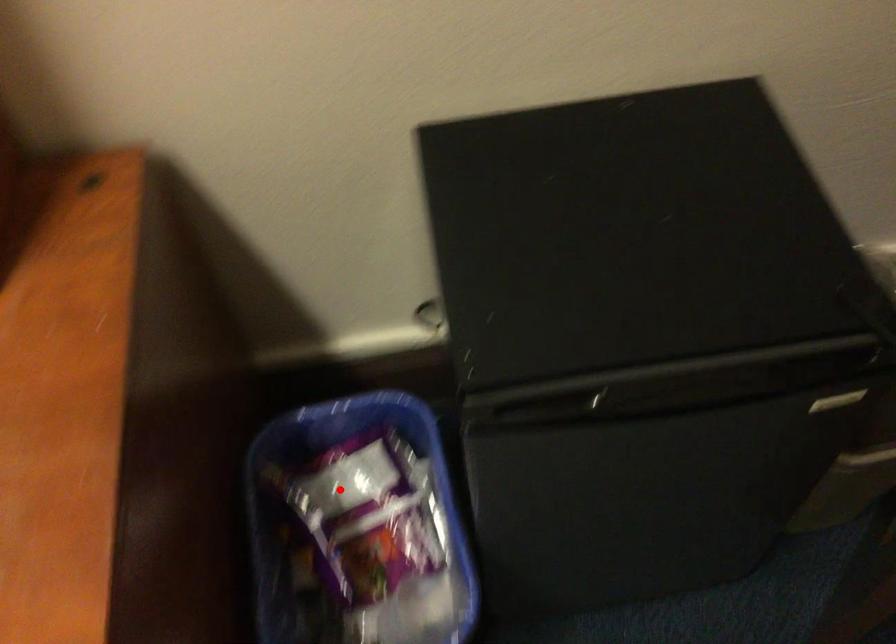
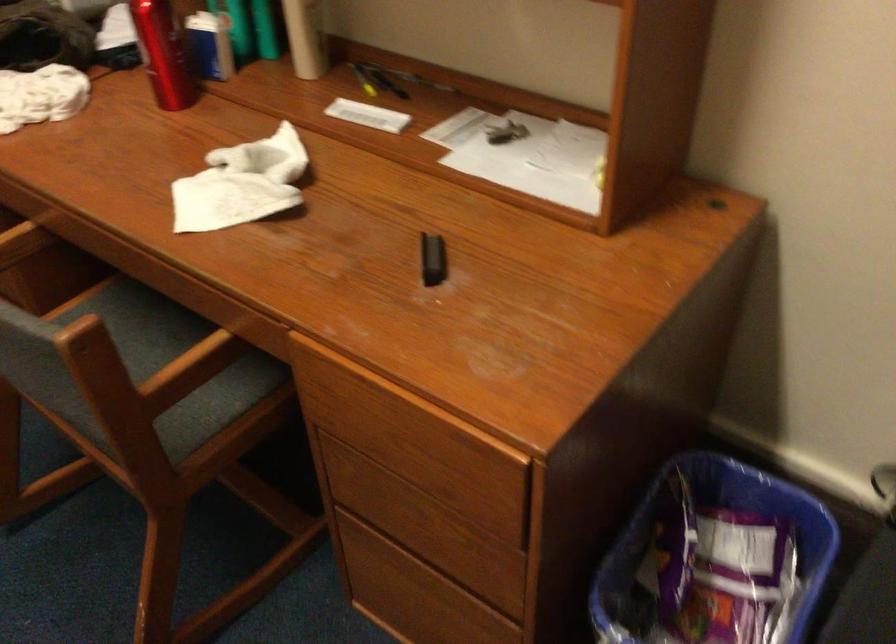
In the second image, find the point that corresponds to the highlighted location in the first image.

(711, 542)